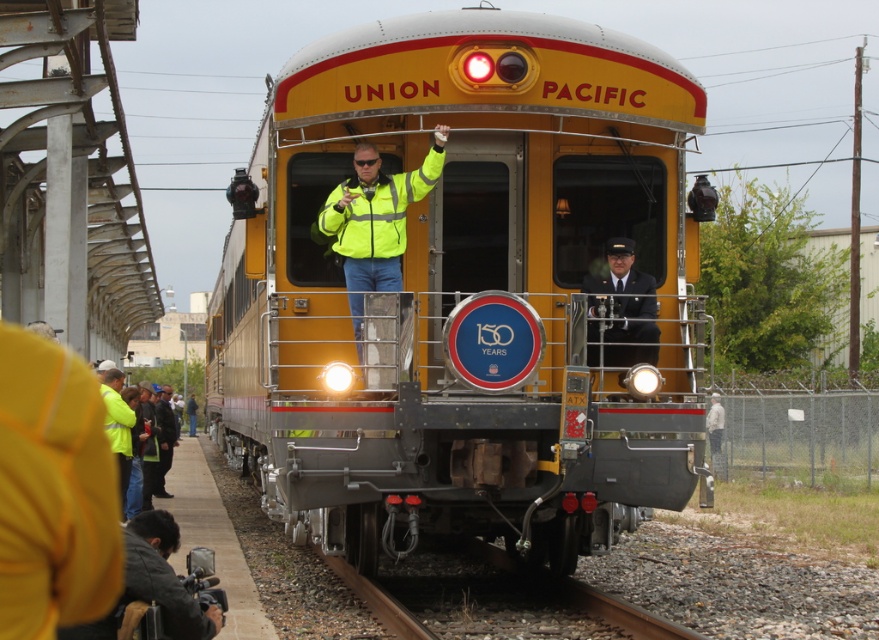
Question: Is dark gray fabric camera at lower left bigger than dark blue uniform at center?

Choices:
 (A) yes
 (B) no

Answer: (A)

Question: Does yellow polished metal train at center appear over neon yellow reflective jacket at center?

Choices:
 (A) no
 (B) yes

Answer: (A)

Question: Which point is farther to the camera?

Choices:
 (A) (649, 339)
 (B) (631, 236)
 (C) (340, 189)
 (D) (208, 636)

Answer: (B)

Question: Which object is closer to the camera taking this photo?

Choices:
 (A) dark blue uniform at center
 (B) dark gray fabric camera at lower left
 (C) neon yellow reflective jacket at center
 (D) yellow polished metal train at center

Answer: (B)

Question: Is dark gray fabric camera at lower left positioned behind dark blue uniform at center?

Choices:
 (A) yes
 (B) no

Answer: (B)

Question: Estimate the real-world distances between objects in this image. Which object is closer to the yellow polished metal train at center?

Choices:
 (A) dark blue uniform at center
 (B) neon yellow reflective jacket at center

Answer: (B)